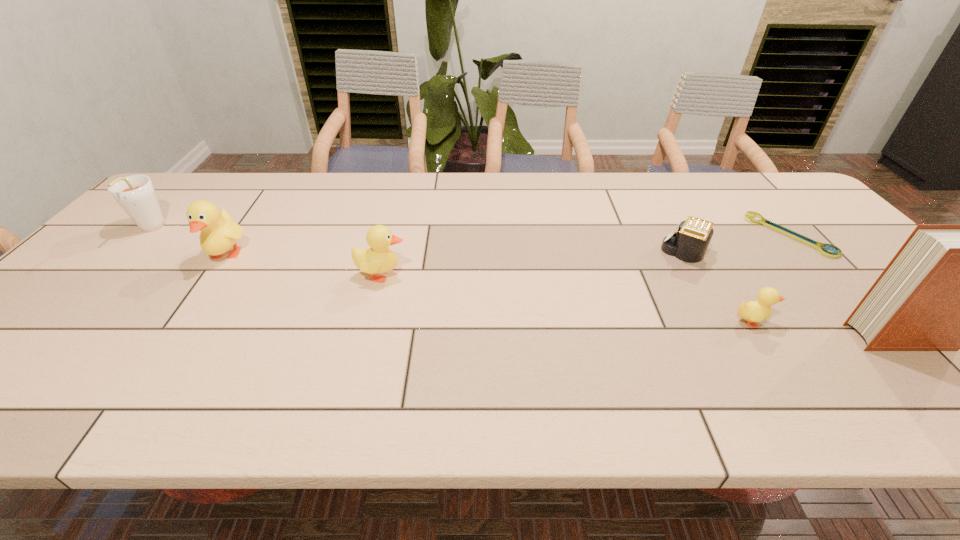
Identify the location of unoccupied area between the root beer and the second object from left to right. The height and width of the screenshot is (540, 960). (188, 242).

Where is `free space between the shortest object and the rightmost duckling`? free space between the shortest object and the rightmost duckling is located at coordinates (770, 278).

Identify the location of empty space between the second duckling from right to left and the second object from left to right. This screenshot has width=960, height=540. (304, 265).

At what (x,y) coordinates should I click in order to perform the action: click on free space between the second duckling from left to right and the shortest object. Please return your answer as a coordinate pair (x, y). This screenshot has width=960, height=540. Looking at the image, I should click on (586, 255).

Locate an element on the screen. vacant area that lies between the shortest object and the leftmost object is located at coordinates (469, 232).

You are a GUI agent. You are given a task and a screenshot of the screen. Output one action in this format:
    pyautogui.click(x=<x>, y=<y>)
    Task: Click on the free space between the calculator and the rightmost duckling
    
    Given the screenshot: What is the action you would take?
    [x=718, y=287]

Where is `empty space between the leftmost object and the wrench`? Image resolution: width=960 pixels, height=540 pixels. empty space between the leftmost object and the wrench is located at coordinates (469, 232).

Find the location of a particular element. free space between the shortest object and the calculator is located at coordinates point(737,244).

Select which object is the closest to the leftmost duckling. Please provide its 2D coordinates. Your answer should be formatted as a tuple, i.e. [(x, y)], where the tuple contains the x and y coordinates of a point satisfying the conditions above.

[(135, 194)]

Select which object is the closest to the calculator. Please provide its 2D coordinates. Your answer should be formatted as a tuple, i.e. [(x, y)], where the tuple contains the x and y coordinates of a point satisfying the conditions above.

[(753, 311)]